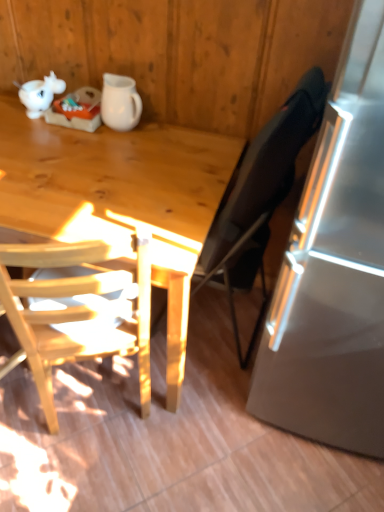
You are a GUI agent. You are given a task and a screenshot of the screen. Output one action in this format:
    pyautogui.click(x=<x>, y=<y>)
    Task: Click on the vacant space to the right of light wood chair at left, positioned as the 1th chair in left-to-right order
    The width and height of the screenshot is (384, 512).
    Given the screenshot: What is the action you would take?
    pyautogui.click(x=211, y=426)